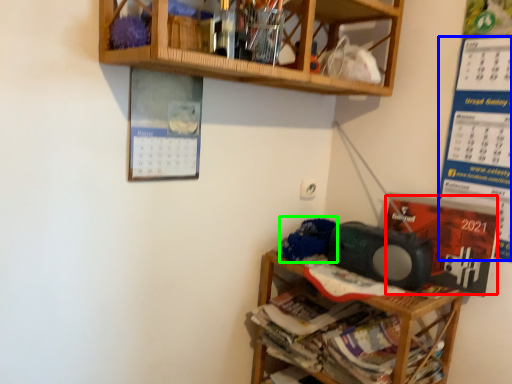
Question: Which object is the farthest from writing (highlighted by a red box)? Choose among these: writing (highlighted by a blue box) or waste (highlighted by a green box).

Choices:
 (A) writing
 (B) waste

Answer: (B)